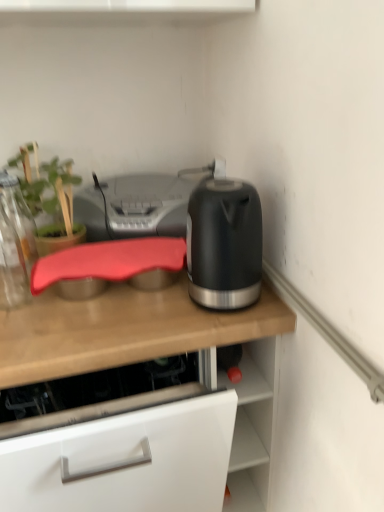
What do you see at coordinates (47, 185) in the screenshot?
I see `green matte plant at upper left` at bounding box center [47, 185].

I want to click on green matte plant at upper left, so click(47, 185).

Locate an element on the screen. This screenshot has height=512, width=384. transparent glass bottle at left is located at coordinates (11, 266).

What do you see at coordinates (11, 266) in the screenshot? I see `transparent glass bottle at left` at bounding box center [11, 266].

This screenshot has width=384, height=512. What are the coordinates of `matte black kettle at right` in the screenshot? It's located at (223, 241).

Which object is more forward, matte black kettle at right or transparent glass bottle at left?

Positioned in front is matte black kettle at right.

Considering the relative sizes of matte black kettle at right and transparent glass bottle at left in the image provided, is matte black kettle at right wider than transparent glass bottle at left?

No, matte black kettle at right is not wider than transparent glass bottle at left.

From a real-world perspective, is matte black kettle at right located beneath transparent glass bottle at left?

Actually, matte black kettle at right is physically above transparent glass bottle at left in the real world.

Between point (242, 214) and point (5, 285), which one is positioned in front?

The point (242, 214) is closer.

Locate an element on the screen. The image size is (384, 512). countertop on the left of matte black kettle at right is located at coordinates (131, 402).

Does matte black kettle at right appear on the left side of matte wooden countertop at center?

Incorrect, matte black kettle at right is not on the left side of matte wooden countertop at center.

Is point (222, 263) closer or farther from the camera than point (136, 348)?

Point (222, 263).

Is matte black kettle at right positioned far away from matte wooden countertop at center?

No, matte black kettle at right is not far away from matte wooden countertop at center.

Does green matte plant at upper left appear on the right side of matte wooden countertop at center?

No, green matte plant at upper left is not to the right of matte wooden countertop at center.

Is green matte plant at upper left not near matte wooden countertop at center?

That's not correct — green matte plant at upper left is a little close to matte wooden countertop at center.

From a real-world perspective, relative to matte wooden countertop at center, is green matte plant at upper left vertically above or below?

In terms of real-world spatial position, green matte plant at upper left is above matte wooden countertop at center.

Looking at their sizes, would you say silver metallic printer at center is wider or thinner than matte wooden countertop at center?

silver metallic printer at center is thinner than matte wooden countertop at center.

Looking at this image, from a real-world perspective, who is located higher, silver metallic printer at center or matte wooden countertop at center?

silver metallic printer at center, from a real-world perspective.

Which object is further away from the camera, silver metallic printer at center or matte wooden countertop at center?

silver metallic printer at center is further from the camera.

Is transparent glass bottle at left completely or partially inside silver metallic printer at center?

Actually, transparent glass bottle at left is outside silver metallic printer at center.

Locate an element on the screen. The height and width of the screenshot is (512, 384). bottle below the silver metallic printer at center (from the image's perspective) is located at coordinates (11, 266).

Is transparent glass bottle at left at the back of silver metallic printer at center?

No.

Is silver metallic printer at center wider or thinner than transparent glass bottle at left?

Considering their sizes, silver metallic printer at center looks slimmer than transparent glass bottle at left.

Which is in front, point (1, 240) or point (243, 464)?

The point (243, 464) is in front.

From the picture: Does transparent glass bottle at left have a greater width compared to matte wooden countertop at center?

Incorrect, the width of transparent glass bottle at left does not surpass that of matte wooden countertop at center.

From a real-world perspective, is transparent glass bottle at left above or below matte wooden countertop at center?

transparent glass bottle at left is situated higher than matte wooden countertop at center in the real world.

Image resolution: width=384 pixels, height=512 pixels. What are the coordinates of `bottle behind the matte wooden countertop at center` in the screenshot? It's located at (11, 266).

Is green matte plant at upper left not close to matte black kettle at right?

Actually, green matte plant at upper left and matte black kettle at right are a little close together.

From a real-world perspective, relative to matte black kettle at right, is green matte plant at upper left vertically above or below?

green matte plant at upper left is situated higher than matte black kettle at right in the real world.

Measure the distance between green matte plant at upper left and matte black kettle at right.

green matte plant at upper left and matte black kettle at right are 16.62 inches apart from each other.

Is green matte plant at upper left bigger or smaller than matte black kettle at right?

Clearly, green matte plant at upper left is smaller in size than matte black kettle at right.

I want to click on bottle located behind the matte black kettle at right, so click(11, 266).

Locate an element on the screen. This screenshot has width=384, height=512. kitchen appliance located on the right of matte wooden countertop at center is located at coordinates [x=223, y=241].

Which object lies further to the anchor point green matte plant at upper left, transparent glass bottle at left or silver metallic printer at center?

transparent glass bottle at left.

Looking at the image, which one is located closer to green matte plant at upper left, silver metallic printer at center or transparent glass bottle at left?

silver metallic printer at center is closer to green matte plant at upper left.

Based on their spatial positions, is transparent glass bottle at left or silver metallic printer at center further from matte wooden countertop at center?

silver metallic printer at center is positioned further to the anchor matte wooden countertop at center.

Looking at the image, which one is located further to transparent glass bottle at left, silver metallic printer at center or green matte plant at upper left?

Among the two, silver metallic printer at center is located further to transparent glass bottle at left.

When comparing their distances from transparent glass bottle at left, does matte black kettle at right or silver metallic printer at center seem further?

The object further to transparent glass bottle at left is matte black kettle at right.

Which object lies further to the anchor point matte wooden countertop at center, transparent glass bottle at left or green matte plant at upper left?

green matte plant at upper left is further to matte wooden countertop at center.

When comparing their distances from matte black kettle at right, does green matte plant at upper left or silver metallic printer at center seem closer?

silver metallic printer at center lies closer to matte black kettle at right than the other object.

When comparing their distances from silver metallic printer at center, does matte wooden countertop at center or green matte plant at upper left seem closer?

Among the two, green matte plant at upper left is located nearer to silver metallic printer at center.

You are a GUI agent. You are given a task and a screenshot of the screen. Output one action in this format:
    pyautogui.click(x=<x>, y=<y>)
    Task: Click on the bottle located between green matte plant at upper left and silver metallic printer at center in the left-right direction
    The width and height of the screenshot is (384, 512).
    Given the screenshot: What is the action you would take?
    pyautogui.click(x=11, y=266)

Find the location of a particular element. kitchen appliance between green matte plant at upper left and matte wooden countertop at center in the vertical direction is located at coordinates (223, 241).

Locate an element on the screen. This screenshot has height=512, width=384. bottle between green matte plant at upper left and matte wooden countertop at center from top to bottom is located at coordinates (11, 266).

Find the location of a particular element. The height and width of the screenshot is (512, 384). printer between green matte plant at upper left and matte black kettle at right in the horizontal direction is located at coordinates (136, 205).